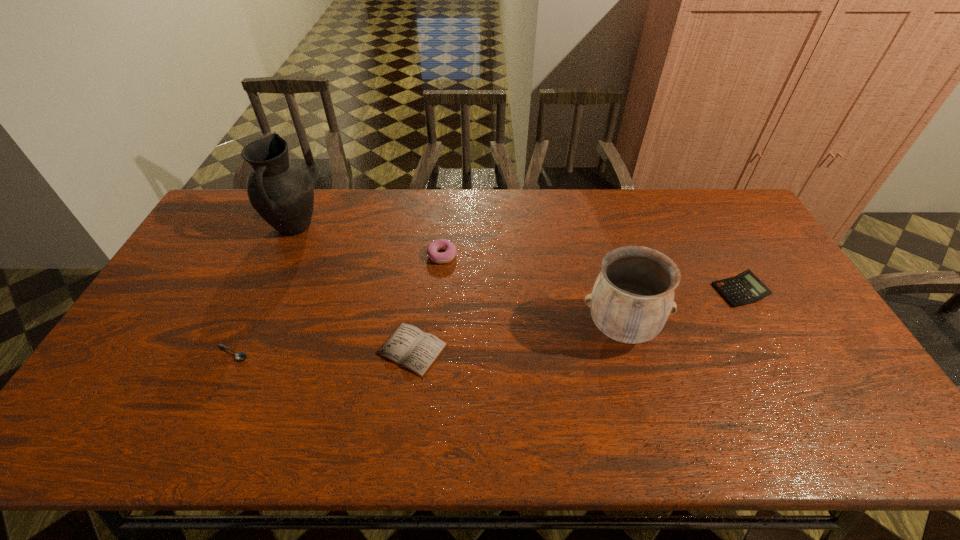
You are a GUI agent. You are given a task and a screenshot of the screen. Output one action in this format:
    pyautogui.click(x=<x>, y=<y>)
    Task: Click on the vacant space that is in between the calculator and the pitcher
    
    Given the screenshot: What is the action you would take?
    pyautogui.click(x=516, y=260)

I want to click on vacant region between the tallest object and the rightmost object, so (x=516, y=260).

Locate an element on the screen. The height and width of the screenshot is (540, 960). free spot between the diary and the tallest object is located at coordinates (353, 288).

Where is `free space that is in between the tallest object and the soupspoon`? Image resolution: width=960 pixels, height=540 pixels. free space that is in between the tallest object and the soupspoon is located at coordinates (x=263, y=291).

Identify the location of vacant space that's between the pastry and the shortest object. Image resolution: width=960 pixels, height=540 pixels. (337, 304).

This screenshot has height=540, width=960. I want to click on free area in between the fifth tallest object and the pitcher, so click(353, 288).

Where is `blank region between the diary and the shortest object`? blank region between the diary and the shortest object is located at coordinates (323, 351).

This screenshot has width=960, height=540. I want to click on vacant area that lies between the rightmost object and the shortest object, so click(486, 322).

You are a GUI agent. You are given a task and a screenshot of the screen. Output one action in this format:
    pyautogui.click(x=<x>, y=<y>)
    Task: Click on the free space between the second shortest object and the soupspoon
    The image size is (960, 540).
    Given the screenshot: What is the action you would take?
    pyautogui.click(x=323, y=351)

Find the location of a particular element. This screenshot has height=540, width=960. the second closest object to the calculator is located at coordinates (441, 244).